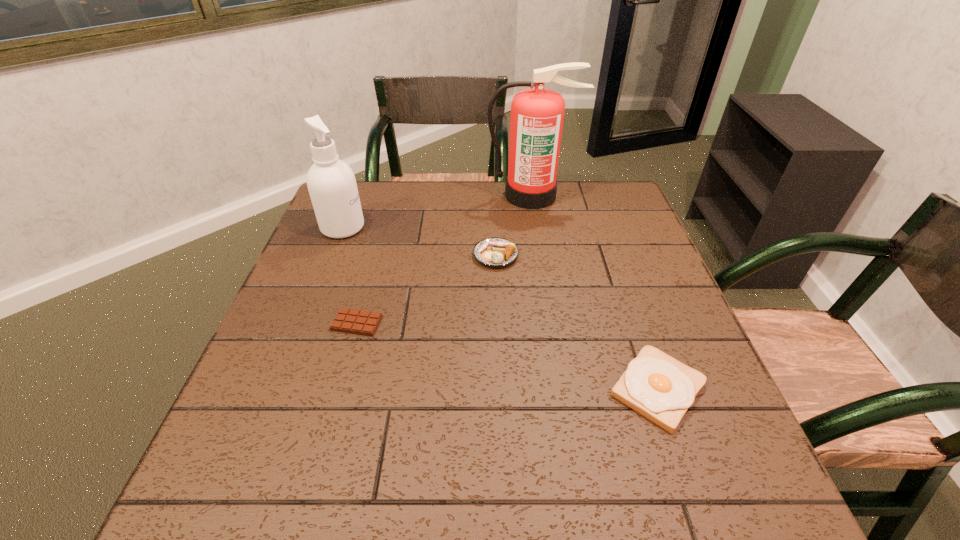
The height and width of the screenshot is (540, 960). Find the location of `vacant space that's between the third farthest object and the fire extinguisher`. vacant space that's between the third farthest object and the fire extinguisher is located at coordinates (514, 225).

Where is `free space that is in between the second object from left to right and the farthest object`? This screenshot has height=540, width=960. free space that is in between the second object from left to right and the farthest object is located at coordinates (444, 259).

Locate an element on the screen. The width and height of the screenshot is (960, 540). vacant area that lies between the second shortest object and the shortest object is located at coordinates (508, 356).

This screenshot has width=960, height=540. In order to click on empty space that is in between the fourth object from right to left and the toast in this screenshot , I will do `click(508, 356)`.

The height and width of the screenshot is (540, 960). In order to click on free spot between the fourth tallest object and the fourth object from right to left in this screenshot , I will do `click(508, 356)`.

Find the location of a particular element. The height and width of the screenshot is (540, 960). empty space between the toast and the second farthest object is located at coordinates (500, 308).

Locate an element on the screen. The height and width of the screenshot is (540, 960). free space between the leftmost object and the fire extinguisher is located at coordinates (437, 211).

Identify the location of object that ranks as the third closest to the leftmost object. The width and height of the screenshot is (960, 540). (537, 114).

I want to click on object that stands as the third closest to the shortest object, so click(659, 387).

The height and width of the screenshot is (540, 960). I want to click on vacant space that satisfies the following two spatial constraints: 1. on the back side of the pastry; 2. on the front label of the second farthest object, so click(x=494, y=227).